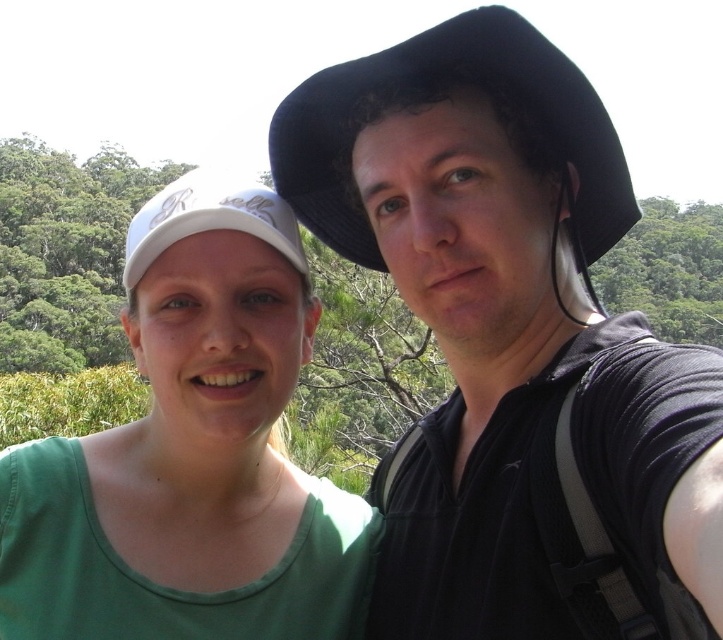
Who is more distant from viewer, (215, 458) or (531, 45)?

Point (215, 458)

This screenshot has width=723, height=640. I want to click on green fabric shirt at left, so click(192, 452).

Where is `green fabric shirt at left`? The image size is (723, 640). green fabric shirt at left is located at coordinates (192, 452).

Does green fabric shirt at left have a smaller size compared to white matte cap at center?

Correct, green fabric shirt at left occupies less space than white matte cap at center.

What do you see at coordinates (192, 452) in the screenshot?
I see `green fabric shirt at left` at bounding box center [192, 452].

At what (x,y) coordinates should I click in order to perform the action: click on green fabric shirt at left. Please return your answer as a coordinate pair (x, y). The image size is (723, 640). Looking at the image, I should click on (192, 452).

Between black fabric cowboy hat at upper center and white matte cap at center, which one is positioned higher?

black fabric cowboy hat at upper center

Which is more to the right, black fabric cowboy hat at upper center or white matte cap at center?

From the viewer's perspective, black fabric cowboy hat at upper center appears more on the right side.

Image resolution: width=723 pixels, height=640 pixels. What are the coordinates of `black fabric cowboy hat at upper center` in the screenshot? It's located at (436, 88).

Locate an element on the screen. black fabric cowboy hat at upper center is located at coordinates (436, 88).